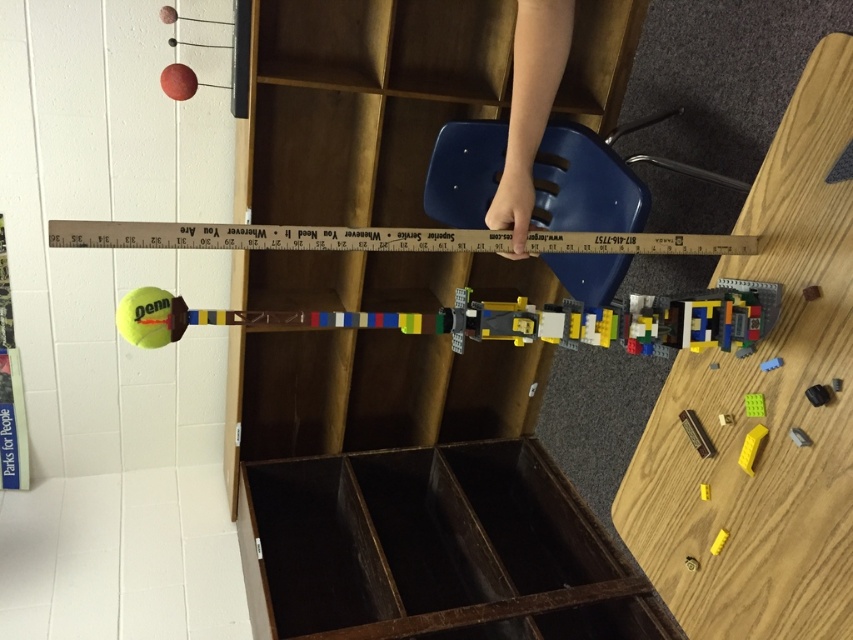
Question: Which is nearer to the wooden at center?

Choices:
 (A) yellow matte plastic block at lower right
 (B) white plastic ruler at center

Answer: (B)

Question: Observing the image, what is the correct spatial positioning of wooden at center in reference to white plastic ruler at center?

Choices:
 (A) below
 (B) above

Answer: (B)

Question: Which of these objects is positioned farthest from the yellow matte plastic block at lower right?

Choices:
 (A) dark brown wood drawer at center
 (B) white plastic ruler at center
 (C) wooden at center
 (D) yellow rubber tennis ball at lower left

Answer: (C)

Question: Is white plastic ruler at center bigger than yellow rubber tennis ball at lower left?

Choices:
 (A) no
 (B) yes

Answer: (B)

Question: Among these objects, which one is nearest to the camera?

Choices:
 (A) yellow rubber tennis ball at lower left
 (B) wooden at center
 (C) yellow matte plastic block at lower right

Answer: (A)

Question: Is wooden at center positioned in front of dark brown wood drawer at center?

Choices:
 (A) no
 (B) yes

Answer: (A)